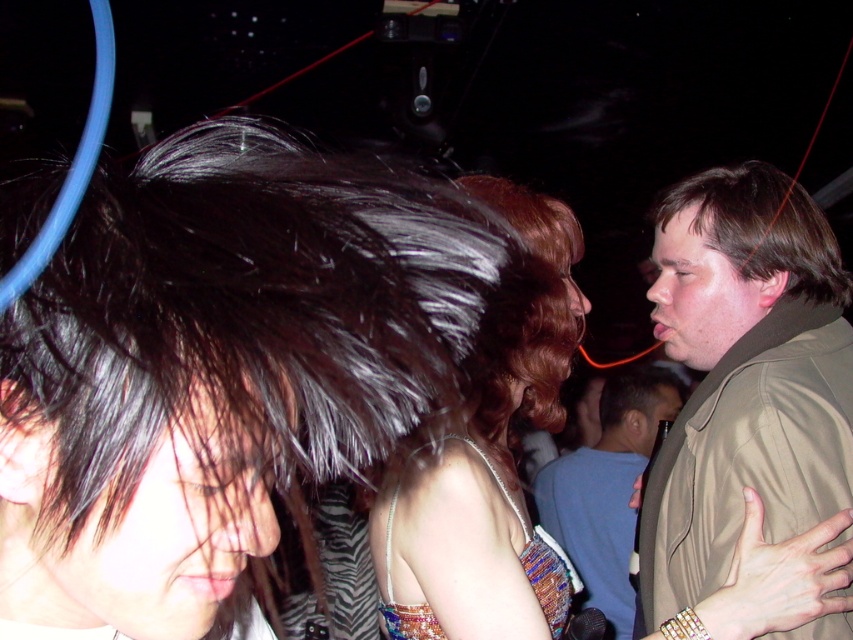
Question: Is khaki fabric jacket at right smaller than brown matte hair at right?

Choices:
 (A) no
 (B) yes

Answer: (A)

Question: Which of the following is the farthest from the observer?

Choices:
 (A) (531, 534)
 (B) (612, 579)

Answer: (B)

Question: Can you confirm if shiny black hair at center is positioned below light blue shirt at center?

Choices:
 (A) no
 (B) yes

Answer: (A)

Question: Which point appears farthest from the camera in this image?

Choices:
 (A) (84, 244)
 (B) (648, 419)

Answer: (B)

Question: Which point is farther from the camera taking this photo?

Choices:
 (A) (790, 211)
 (B) (503, 253)
 (C) (637, 392)
 (D) (793, 529)

Answer: (C)

Question: Can you confirm if shiny black hair at center is positioned to the left of light blue shirt at center?

Choices:
 (A) no
 (B) yes

Answer: (B)